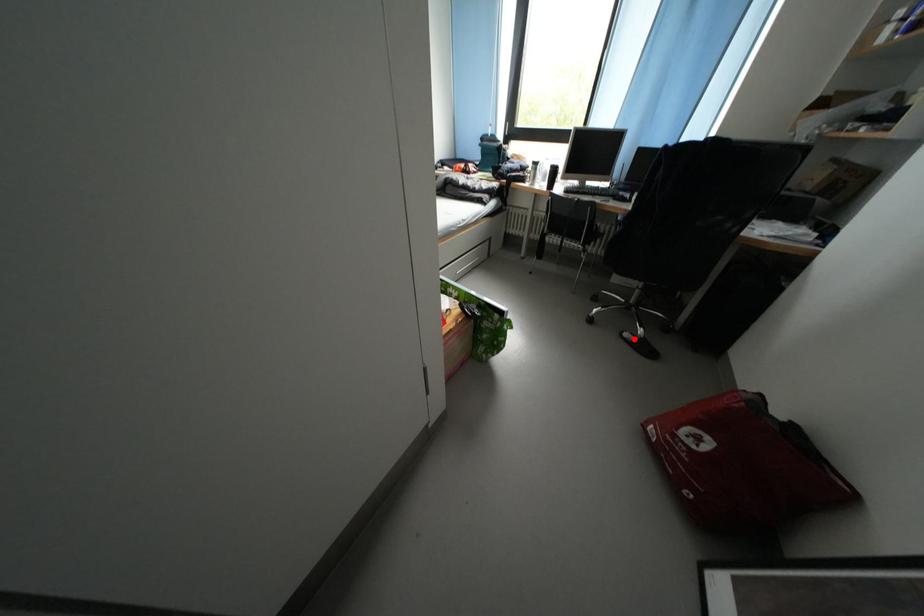
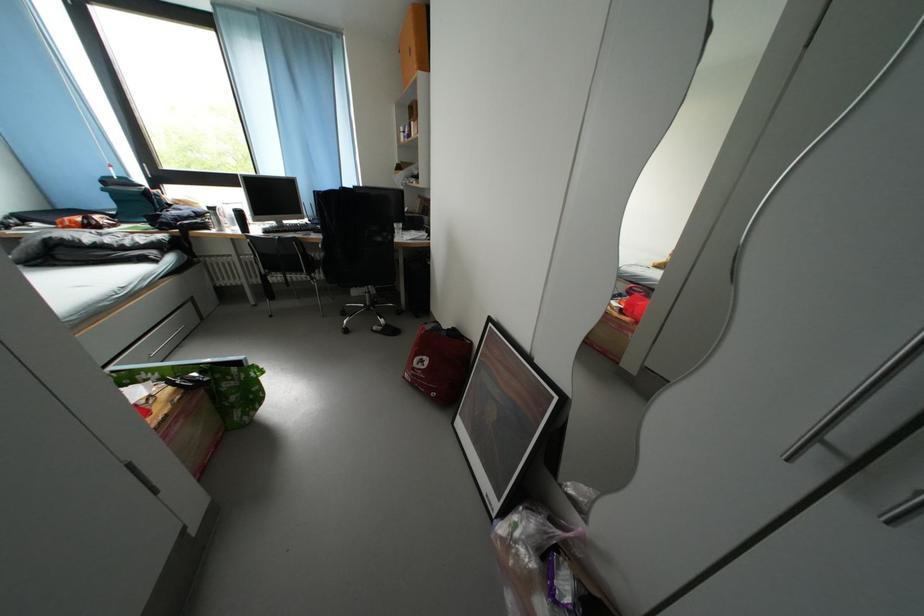
Question: I am providing you with two images of the same scene from different viewpoints. A red point is shown in image1. For the corresponding object point in image2, is it positioned nearer or farther from the camera?

Choices:
 (A) Nearer
 (B) Farther

Answer: (B)